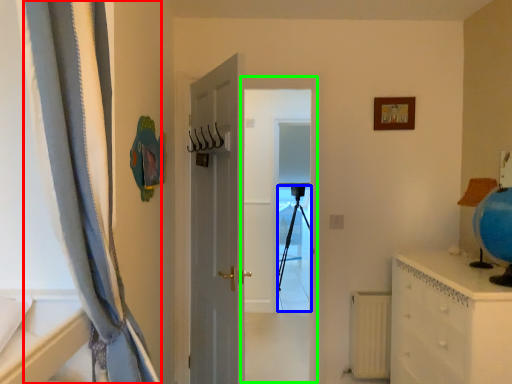
Question: Which object is the farthest from curtain (highlighted by a red box)? Choose among these: tripod (highlighted by a blue box) or screen door (highlighted by a green box).

Choices:
 (A) tripod
 (B) screen door

Answer: (A)